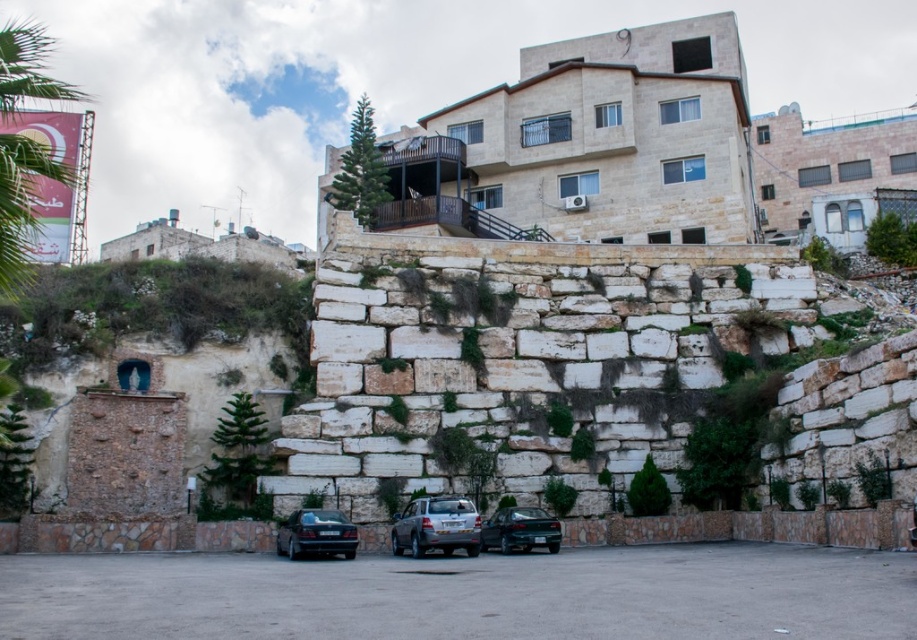
You are a parking attendant who needs to fit a new compact car into the parking space between the shiny black sedan at lower center and the teal glossy sedan at center. Based on their sizes, can the compact car fit in that space?

The shiny black sedan at lower center is smaller than the teal glossy sedan at center. Since the compact car is similar in size to the shiny black sedan at lower center, it might fit in the space between them, but you should measure the available space to be sure.